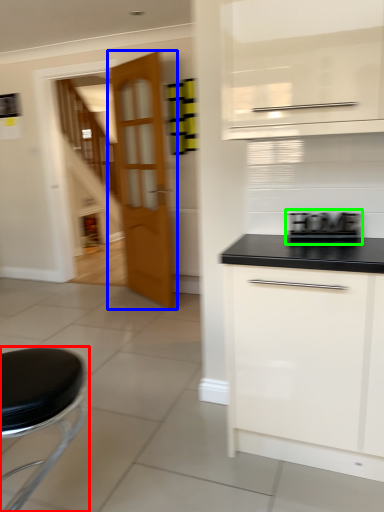
Question: Which object is positioned closest to furniture (highlighted by a red box)? Select from door (highlighted by a blue box) and appliance (highlighted by a green box).

Choices:
 (A) door
 (B) appliance

Answer: (B)